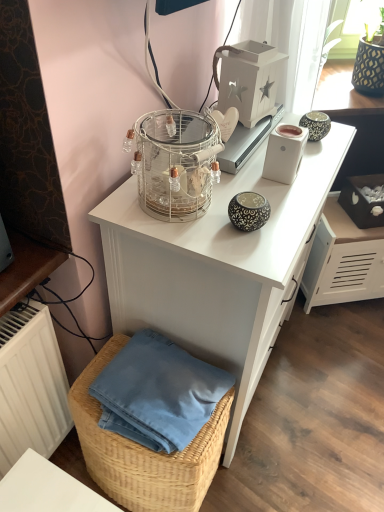
In order to click on free location to the right of white glossy desk at upper center in this screenshot , I will do `click(327, 374)`.